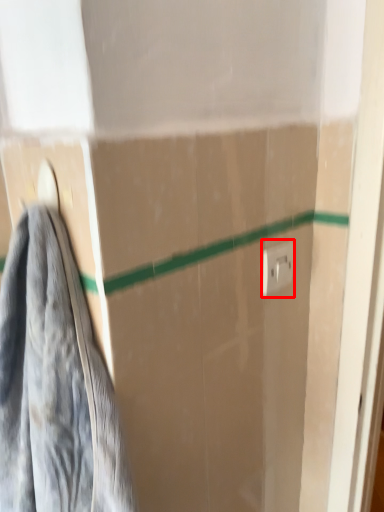
Question: From the image, what is the correct spatial relationship of electric outlet (annotated by the red box) in relation to towel?

Choices:
 (A) right
 (B) left

Answer: (A)